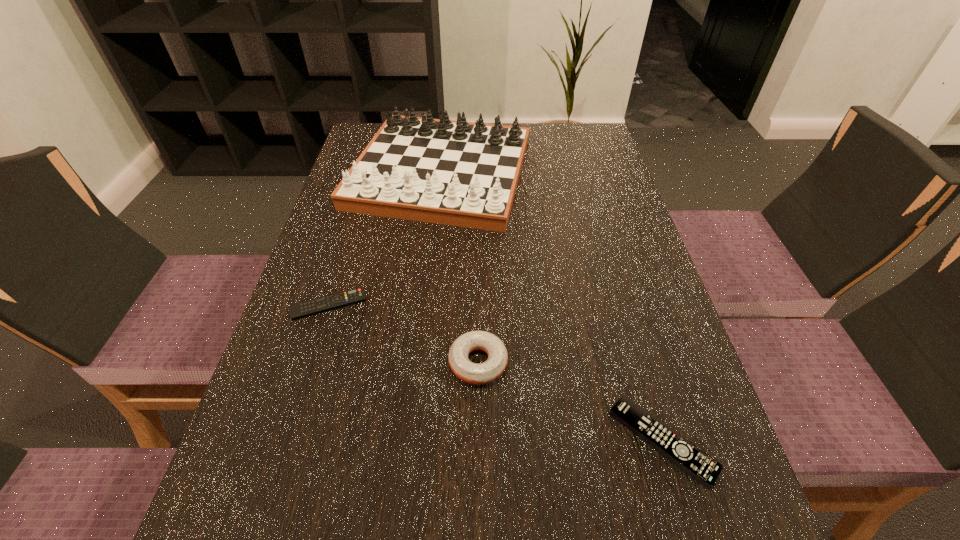
You are a GUI agent. You are given a task and a screenshot of the screen. Output one action in this format:
    pyautogui.click(x=<x>, y=<y>)
    Task: Click on the gameboard
    The image size is (960, 540).
    Given the screenshot: What is the action you would take?
    pyautogui.click(x=458, y=173)

This screenshot has height=540, width=960. What are the coordinates of `the tallest object` in the screenshot? It's located at pyautogui.click(x=458, y=173).

You are a GUI agent. You are given a task and a screenshot of the screen. Output one action in this format:
    pyautogui.click(x=<x>, y=<y>)
    Task: Click on the doughnut
    Image resolution: width=960 pixels, height=540 pixels.
    Given the screenshot: What is the action you would take?
    pyautogui.click(x=482, y=373)

At what (x,y) coordinates should I click in order to perform the action: click on the second nearest object. Please return your answer as a coordinate pair (x, y). This screenshot has height=540, width=960. Looking at the image, I should click on click(482, 373).

Locate an element on the screen. The width and height of the screenshot is (960, 540). the nearest object is located at coordinates (689, 458).

This screenshot has height=540, width=960. Find the location of `the right remote control`. the right remote control is located at coordinates (689, 458).

Locate an element on the screen. the farther remote control is located at coordinates (315, 306).

This screenshot has width=960, height=540. Identify the location of the third nearest object. (315, 306).

The width and height of the screenshot is (960, 540). What are the coordinates of `free space located on the right of the gameboard` in the screenshot? It's located at (592, 173).

This screenshot has width=960, height=540. In order to click on free location located 0.120m on the back of the doughnut in this screenshot , I will do `click(478, 290)`.